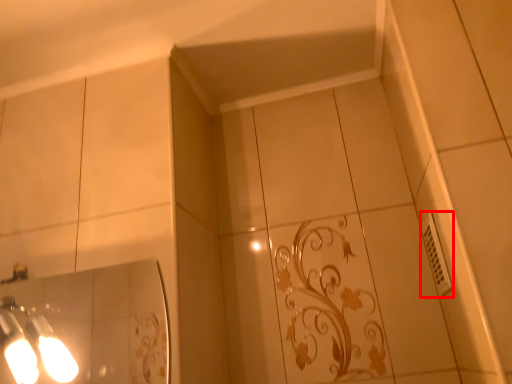
Question: Observing the image, what is the correct spatial positioning of electric outlet (annotated by the red box) in reference to light fixture?

Choices:
 (A) right
 (B) left

Answer: (A)